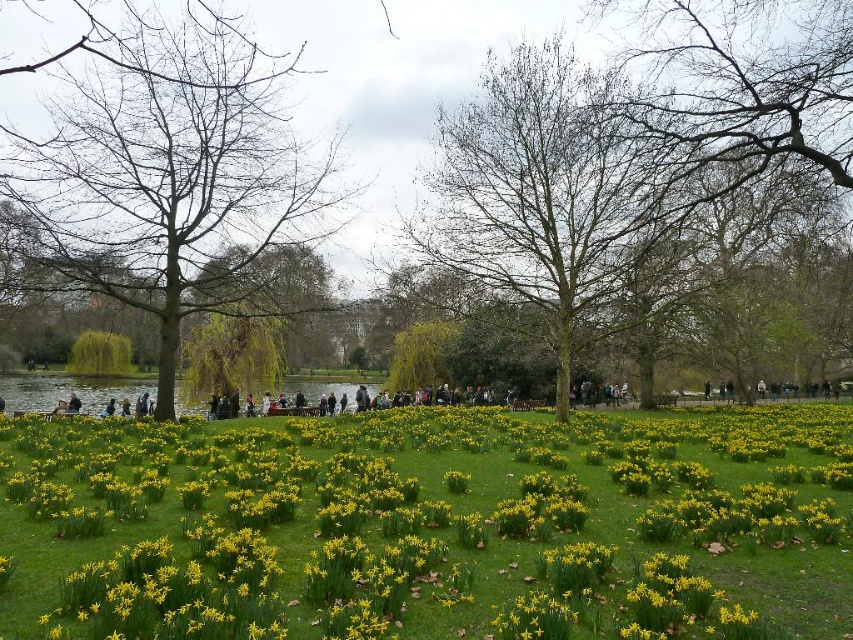
You are planning to place a small picnic blanket in the park. The yellow grass at center and the bare branches at center are both in the area. Which of these two has a wider spread, making it more suitable for placing the blanket without obstruction?

The yellow grass at center has a larger width than the bare branches at center, so placing the picnic blanket there would be more suitable as it offers a wider, unobstructed area.

Based on the photo, you are a park visitor who wants to take a photo of the bare branches at center and the bare wood tree at left. Which one should you zoom in more on to capture their details clearly?

The bare branches at center is bigger than the bare wood tree at left, so you should zoom in more on the bare wood tree at left to capture its details clearly.